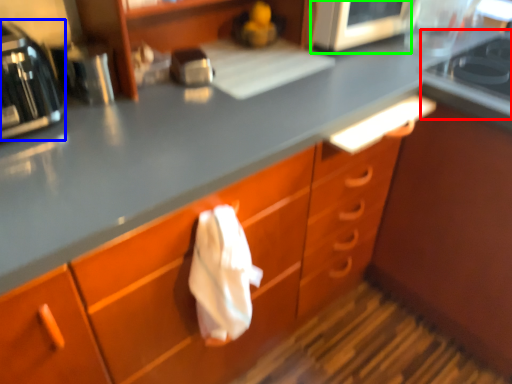
Question: Based on their relative distances, which object is farther from gas stove (highlighted by a red box)? Choose from home appliance (highlighted by a blue box) and appliance (highlighted by a green box).

Choices:
 (A) home appliance
 (B) appliance

Answer: (A)